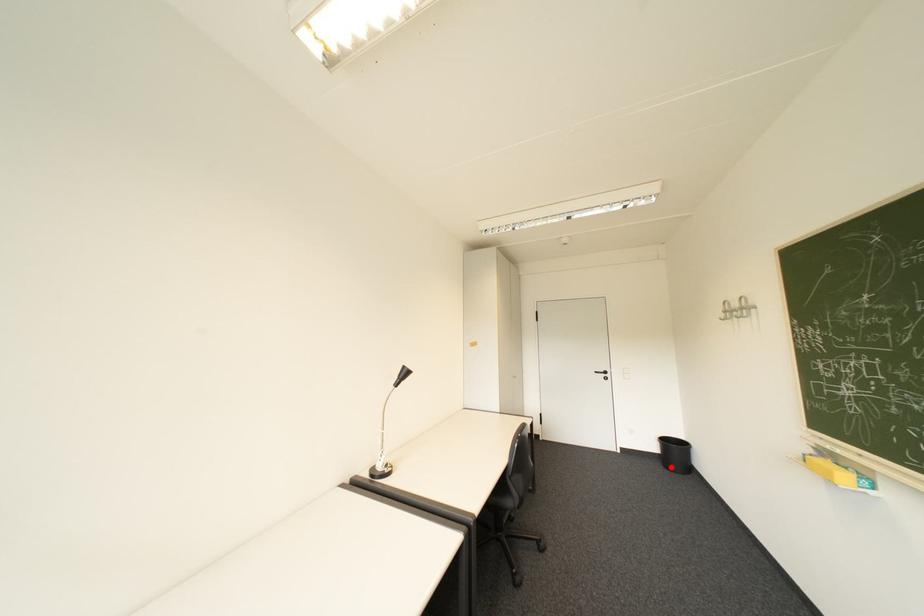
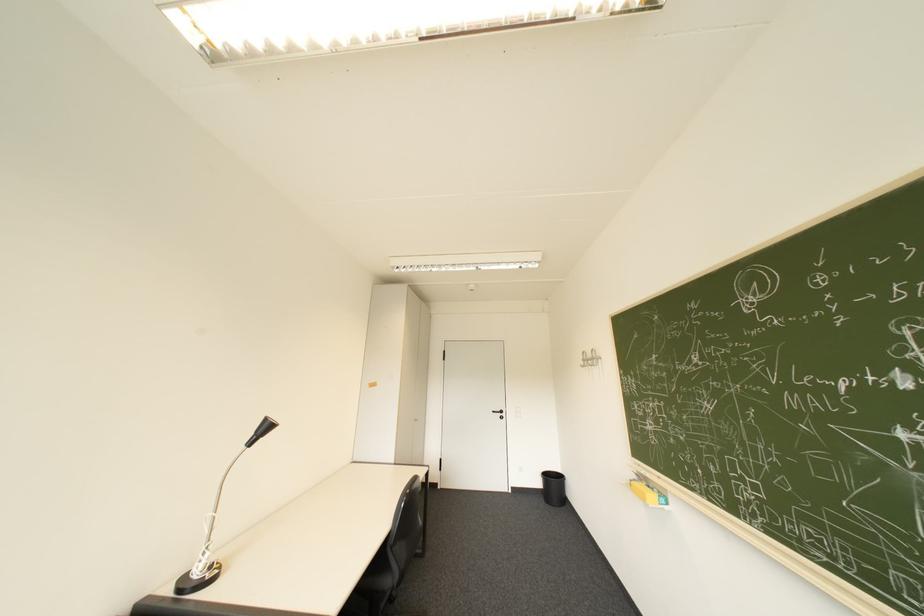
The point at the highlighted location is marked in the first image. Where is the corresponding point in the second image?

(553, 501)